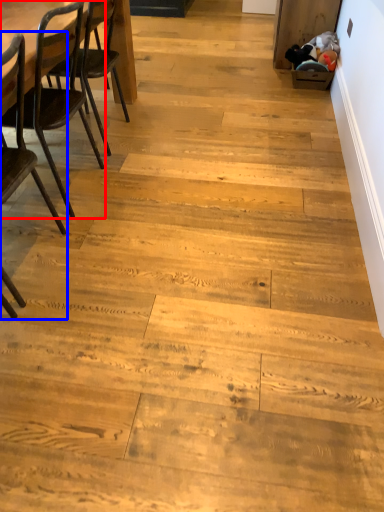
Question: Which object appears farthest to the camera in this image, chair (highlighted by a red box) or chair (highlighted by a blue box)?

Choices:
 (A) chair
 (B) chair

Answer: (A)